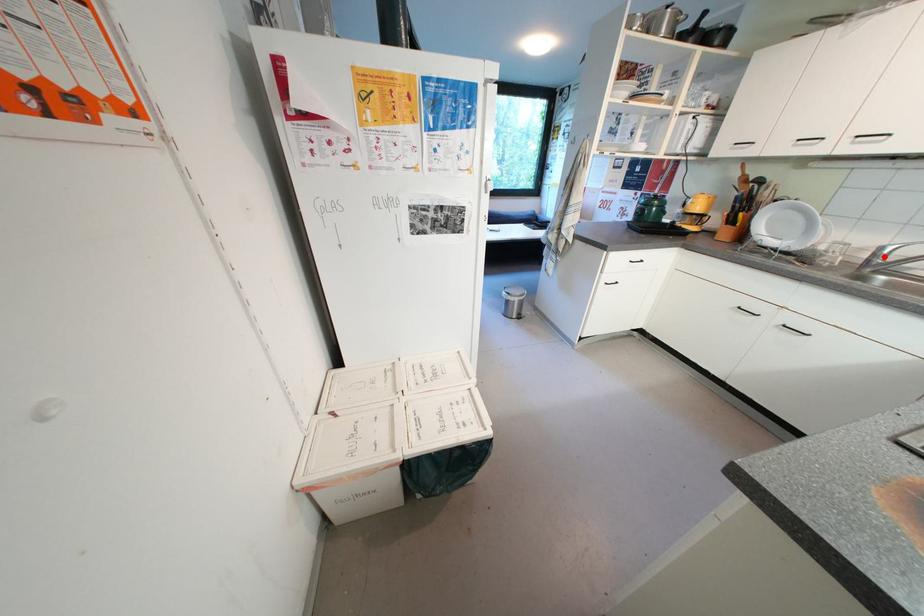
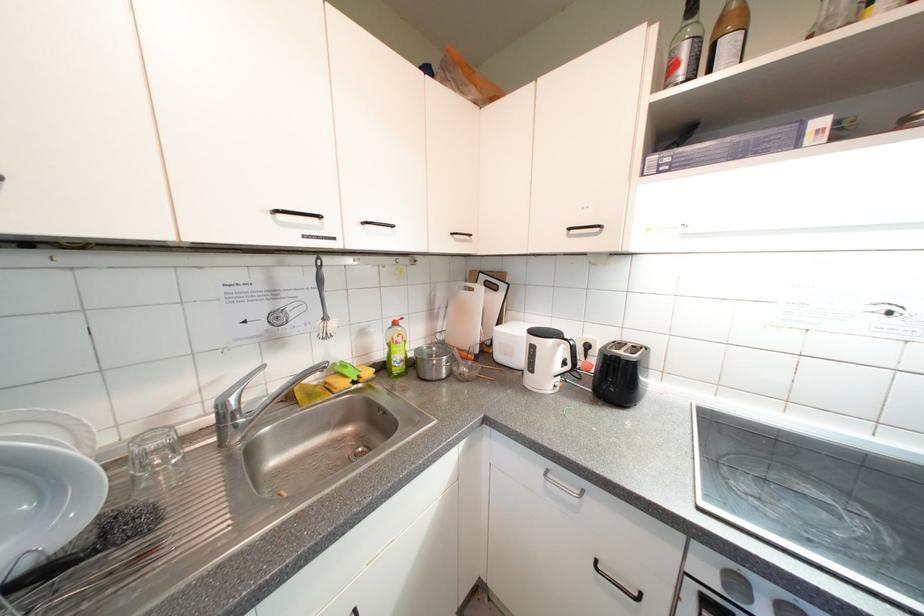
Question: I am providing you with two images of the same scene from different viewpoints. In image1, a red point is highlighted. Considering the same 3D point in image2, which of the following is correct?

Choices:
 (A) It is closer
 (B) It is farther

Answer: (A)